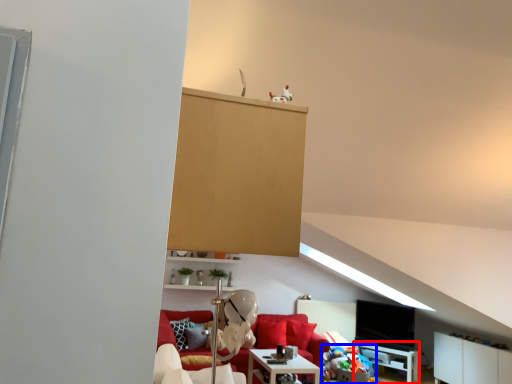
Question: Among these objects, which one is nearest to the camera, table (highlighted by a red box) or stuff (highlighted by a blue box)?

Choices:
 (A) table
 (B) stuff

Answer: (B)